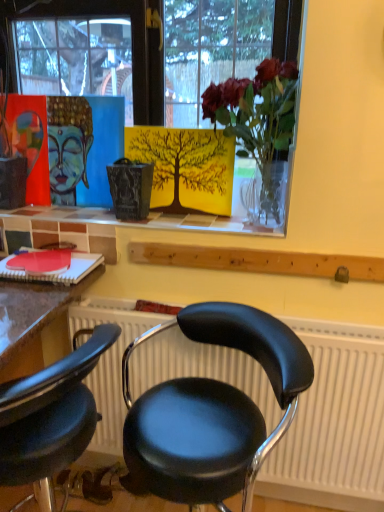
Identify the location of free spot above matte glass vase at upper center (from a real-world perspective). The height and width of the screenshot is (512, 384). (132, 216).